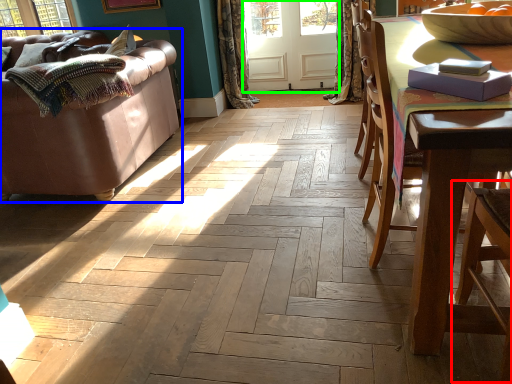
Question: Which object is positioned closest to armchair (highlighted by a red box)? Select from studio couch (highlighted by a blue box) and screen door (highlighted by a green box).

Choices:
 (A) studio couch
 (B) screen door

Answer: (A)